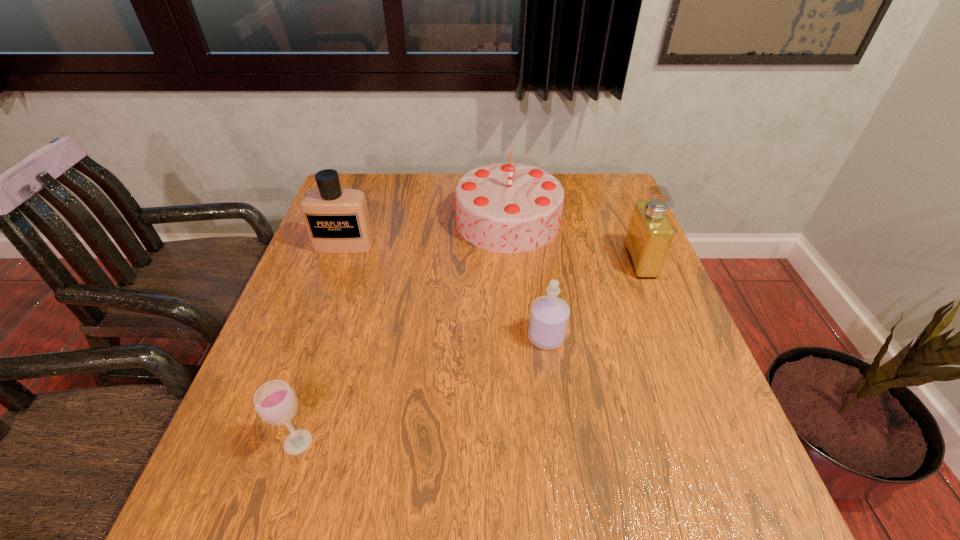
You are a GUI agent. You are given a task and a screenshot of the screen. Output one action in this format:
    pyautogui.click(x=<x>, y=<y>)
    Task: Click on the vacant space at the right edge
    This screenshot has width=960, height=540.
    Given the screenshot: What is the action you would take?
    pyautogui.click(x=700, y=399)

Where is `free spot at the near left corner of the desktop`? free spot at the near left corner of the desktop is located at coordinates (248, 495).

Identify the location of free space at the far right corner. (613, 191).

The width and height of the screenshot is (960, 540). Identify the location of vacant area that lies between the rightmost object and the birthday cake. (574, 241).

What are the coordinates of `vacant area between the nearest object and the birthday cake` in the screenshot? It's located at (403, 331).

I want to click on vacant space that is in between the birthday cake and the leftmost perfume, so click(x=426, y=233).

Where is `free space between the nearest object and the birthday cake`? free space between the nearest object and the birthday cake is located at coordinates (403, 331).

Locate an element on the screen. free space between the fourth farthest object and the rightmost object is located at coordinates (593, 299).

Locate an element on the screen. Image resolution: width=960 pixels, height=540 pixels. blank region between the birthday cake and the nearest object is located at coordinates (403, 331).

What are the coordinates of `free spot between the birthday cake and the wineglass` in the screenshot? It's located at (403, 331).